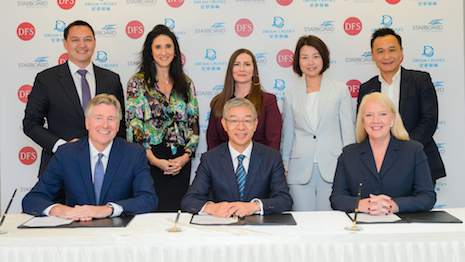
The width and height of the screenshot is (465, 262). Find the location of `pen`. pen is located at coordinates (390, 126), (7, 206), (178, 217), (355, 215).